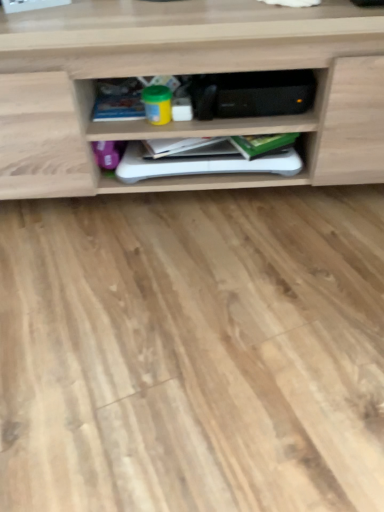
Question: Which direction should I rotate to look at green matte book at center, which appears as the first book when viewed from the right?

Choices:
 (A) right
 (B) left

Answer: (A)

Question: Is white matte book at center, the 2th book in the right-to-left sequence, positioned far away from green matte book at center, the third book in the left-to-right sequence?

Choices:
 (A) yes
 (B) no

Answer: (B)

Question: Does white matte book at center, the 2th book in the right-to-left sequence, appear on the left side of green matte book at center, which appears as the first book when viewed from the right?

Choices:
 (A) no
 (B) yes

Answer: (B)

Question: Is white matte book at center, placed as the second book when sorted from left to right, outside of green matte book at center, the third book in the left-to-right sequence?

Choices:
 (A) yes
 (B) no

Answer: (A)

Question: Is white matte book at center, the 2th book in the right-to-left sequence, aimed at green matte book at center, which appears as the first book when viewed from the right?

Choices:
 (A) no
 (B) yes

Answer: (A)

Question: From a real-world perspective, is white matte book at center, placed as the second book when sorted from left to right, on top of green matte book at center, the third book in the left-to-right sequence?

Choices:
 (A) no
 (B) yes

Answer: (A)

Question: Is white matte book at center, placed as the second book when sorted from left to right, wider than green matte book at center, which appears as the first book when viewed from the right?

Choices:
 (A) no
 (B) yes

Answer: (B)

Question: Is wooden shelf at center facing away from blue matte book at center, which appears as the third book when viewed from the right?

Choices:
 (A) yes
 (B) no

Answer: (A)

Question: From a real-world perspective, is wooden shelf at center beneath blue matte book at center, which appears as the third book when viewed from the right?

Choices:
 (A) no
 (B) yes

Answer: (A)

Question: Considering the relative sizes of wooden shelf at center and blue matte book at center, which appears as the third book when viewed from the right, in the image provided, is wooden shelf at center taller than blue matte book at center, which appears as the third book when viewed from the right,?

Choices:
 (A) yes
 (B) no

Answer: (A)

Question: Does wooden shelf at center have a lesser width compared to blue matte book at center, which appears as the third book when viewed from the right?

Choices:
 (A) yes
 (B) no

Answer: (B)

Question: Could blue matte book at center, the 1th book viewed from the left, be considered to be inside wooden shelf at center?

Choices:
 (A) yes
 (B) no

Answer: (A)

Question: From the image's perspective, is wooden shelf at center on top of blue matte book at center, which appears as the third book when viewed from the right?

Choices:
 (A) yes
 (B) no

Answer: (A)

Question: From a real-world perspective, is blue matte book at center, which appears as the third book when viewed from the right, positioned over green matte book at center, which appears as the first book when viewed from the right, based on gravity?

Choices:
 (A) no
 (B) yes

Answer: (B)